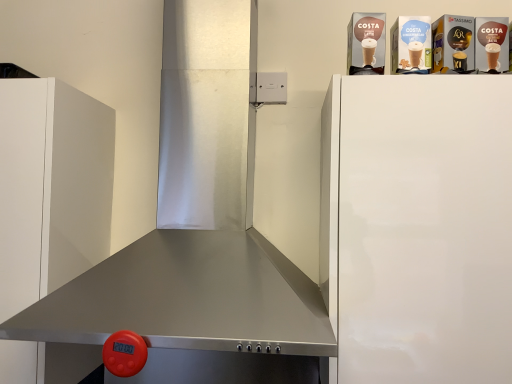
Locate an element on the screen. stainless steel exhaust hood at center is located at coordinates (188, 298).

Where is `white matte cabinet at left`? Image resolution: width=512 pixels, height=384 pixels. white matte cabinet at left is located at coordinates (51, 187).

This screenshot has width=512, height=384. What do you see at coordinates (419, 227) in the screenshot? I see `white glossy refrigerator at upper right` at bounding box center [419, 227].

Locate an element on the screen. The height and width of the screenshot is (384, 512). stainless steel exhaust hood at center is located at coordinates (188, 298).

Is white matte cabinet at left taller than stainless steel exhaust hood at center?

No.

Considering the sizes of objects white matte cabinet at left and stainless steel exhaust hood at center in the image provided, who is smaller, white matte cabinet at left or stainless steel exhaust hood at center?

white matte cabinet at left.

Is white matte cabinet at left aimed at stainless steel exhaust hood at center?

No, white matte cabinet at left is not turned towards stainless steel exhaust hood at center.

Which is behind, white glossy refrigerator at upper right or white matte cabinet at left?

Positioned behind is white matte cabinet at left.

How much distance is there between white glossy refrigerator at upper right and white matte cabinet at left?

70.55 centimeters.

Is white glossy refrigerator at upper right next to white matte cabinet at left?

white glossy refrigerator at upper right and white matte cabinet at left are clearly separated.

From the picture: In terms of size, does white glossy refrigerator at upper right appear bigger or smaller than white matte cabinet at left?

Considering their sizes, white glossy refrigerator at upper right takes up more space than white matte cabinet at left.

Does white matte cabinet at left have a larger size compared to white glossy refrigerator at upper right?

No.

Looking at this image, which of these two, white matte cabinet at left or white glossy refrigerator at upper right, is wider?

Wider between the two is white glossy refrigerator at upper right.

Which object is further away from the camera taking this photo, white matte cabinet at left or white glossy refrigerator at upper right?

white matte cabinet at left is behind.

Who is taller, stainless steel exhaust hood at center or white glossy refrigerator at upper right?

stainless steel exhaust hood at center.

Considering the positions of objects stainless steel exhaust hood at center and white glossy refrigerator at upper right in the image provided, who is more to the right, stainless steel exhaust hood at center or white glossy refrigerator at upper right?

white glossy refrigerator at upper right is more to the right.

Considering the relative sizes of stainless steel exhaust hood at center and white glossy refrigerator at upper right in the image provided, is stainless steel exhaust hood at center bigger than white glossy refrigerator at upper right?

Correct, stainless steel exhaust hood at center is larger in size than white glossy refrigerator at upper right.

Is stainless steel exhaust hood at center aimed at white glossy refrigerator at upper right?

No, stainless steel exhaust hood at center does not turn towards white glossy refrigerator at upper right.

Which is behind, point (496, 335) or point (53, 317)?

The point (496, 335) is more distant.

Is white glossy refrigerator at upper right spatially inside stainless steel exhaust hood at center, or outside of it?

white glossy refrigerator at upper right is not inside stainless steel exhaust hood at center, it's outside.

Measure the distance between white glossy refrigerator at upper right and stainless steel exhaust hood at center.

white glossy refrigerator at upper right is 11.46 inches away from stainless steel exhaust hood at center.

Which object is further away from the camera taking this photo, white glossy refrigerator at upper right or stainless steel exhaust hood at center?

white glossy refrigerator at upper right is behind.

Is stainless steel exhaust hood at center taller than white matte cabinet at left?

Yes, stainless steel exhaust hood at center is taller than white matte cabinet at left.

Is stainless steel exhaust hood at center located outside white matte cabinet at left?

stainless steel exhaust hood at center is positioned outside white matte cabinet at left.

Can you confirm if stainless steel exhaust hood at center is smaller than white matte cabinet at left?

Actually, stainless steel exhaust hood at center might be larger than white matte cabinet at left.

This screenshot has height=384, width=512. Find the location of `cabinetry on the left side of stainless steel exhaust hood at center`. cabinetry on the left side of stainless steel exhaust hood at center is located at coordinates (51, 187).

The height and width of the screenshot is (384, 512). I want to click on cabinetry above the white glossy refrigerator at upper right (from the image's perspective), so click(x=51, y=187).

Considering their positions, is white matte cabinet at left positioned closer to stainless steel exhaust hood at center than white glossy refrigerator at upper right?

Among the two, white glossy refrigerator at upper right is located nearer to stainless steel exhaust hood at center.

Looking at the image, which one is located closer to white glossy refrigerator at upper right, white matte cabinet at left or stainless steel exhaust hood at center?

stainless steel exhaust hood at center lies closer to white glossy refrigerator at upper right than the other object.

Looking at the image, which one is located closer to white matte cabinet at left, stainless steel exhaust hood at center or white glossy refrigerator at upper right?

The object closer to white matte cabinet at left is stainless steel exhaust hood at center.

Based on their spatial positions, is white glossy refrigerator at upper right or stainless steel exhaust hood at center further from white matte cabinet at left?

Based on the image, white glossy refrigerator at upper right appears to be further to white matte cabinet at left.

Consider the image. When comparing their distances from stainless steel exhaust hood at center, does white glossy refrigerator at upper right or white matte cabinet at left seem closer?

white glossy refrigerator at upper right lies closer to stainless steel exhaust hood at center than the other object.

Looking at the image, which one is located closer to white glossy refrigerator at upper right, stainless steel exhaust hood at center or white matte cabinet at left?

The object closer to white glossy refrigerator at upper right is stainless steel exhaust hood at center.

This screenshot has width=512, height=384. What are the coordinates of `exhaust hood located between white matte cabinet at left and white glossy refrigerator at upper right in the left-right direction` in the screenshot? It's located at (188, 298).